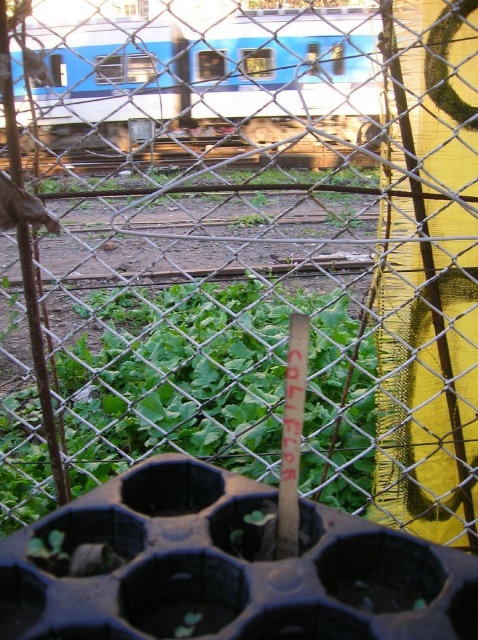
Question: Can you confirm if green leafy plant at center is smaller than blue painted metal train at upper center?

Choices:
 (A) no
 (B) yes

Answer: (B)

Question: Where is green leafy plant at center located in relation to blue painted metal train at upper center in the image?

Choices:
 (A) below
 (B) above

Answer: (A)

Question: Is green leafy plant at center to the left of blue painted metal train at upper center from the viewer's perspective?

Choices:
 (A) yes
 (B) no

Answer: (B)

Question: Which object is closer to the camera taking this photo?

Choices:
 (A) blue painted metal train at upper center
 (B) green leafy plant at center

Answer: (A)